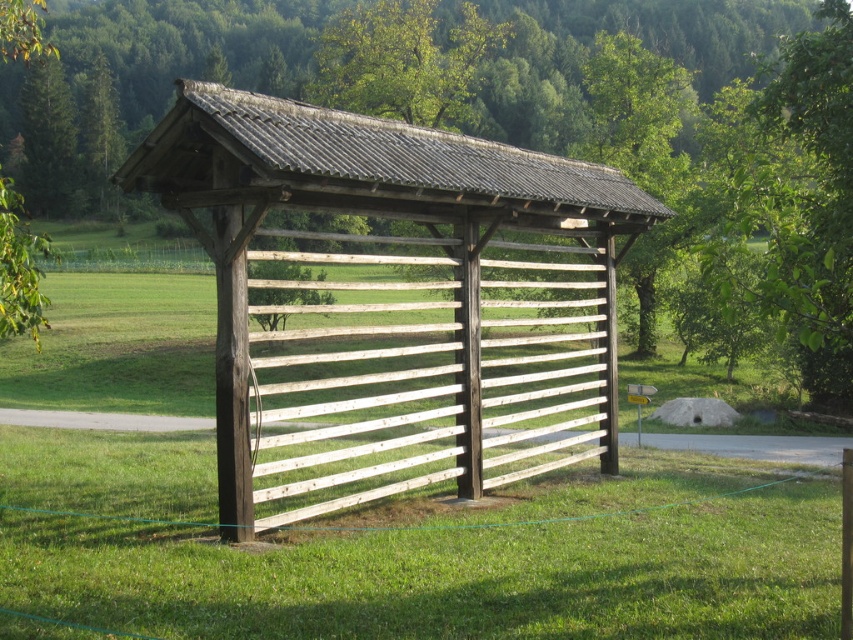
You are standing at the base of the farm shed and want to place a small potted plant exactly where the green grass at center is. Given that the point is located at coordinates point (x=419, y=548), can you confirm if this location is within the open area of the farm shed?

The point (x=419, y=548) marks green grass at center, which is within the open area of the farm shed as the structure has slatted sides allowing access to the central area.

You are a gardener who wants to place a small potted plant on the ground near the wooden slats at center. Based on the scene, can you determine if the green grass at center will be visible once the potted plant is placed there?

The green grass at center is shorter than wooden slats at center, so yes, the grass will still be visible because it is shorter than the wooden slats.